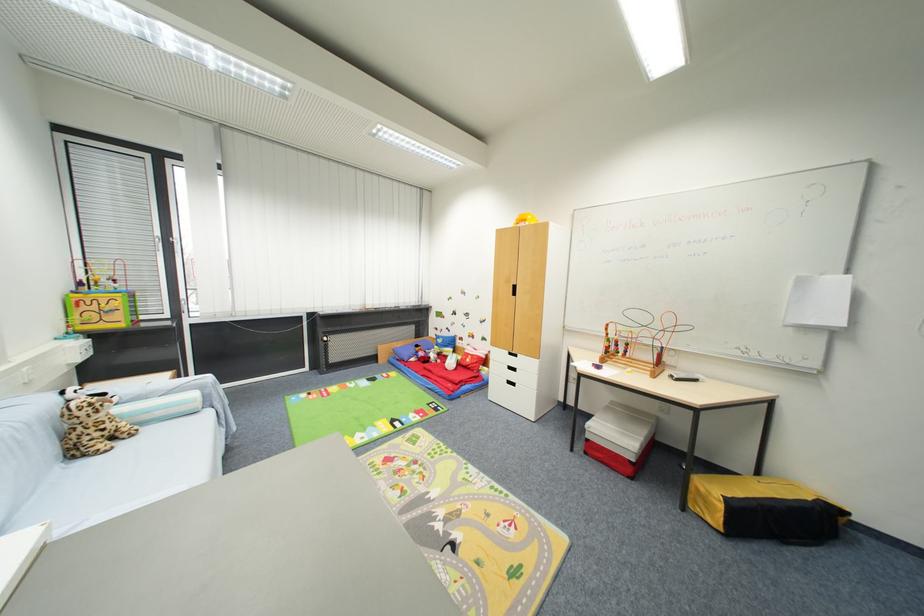
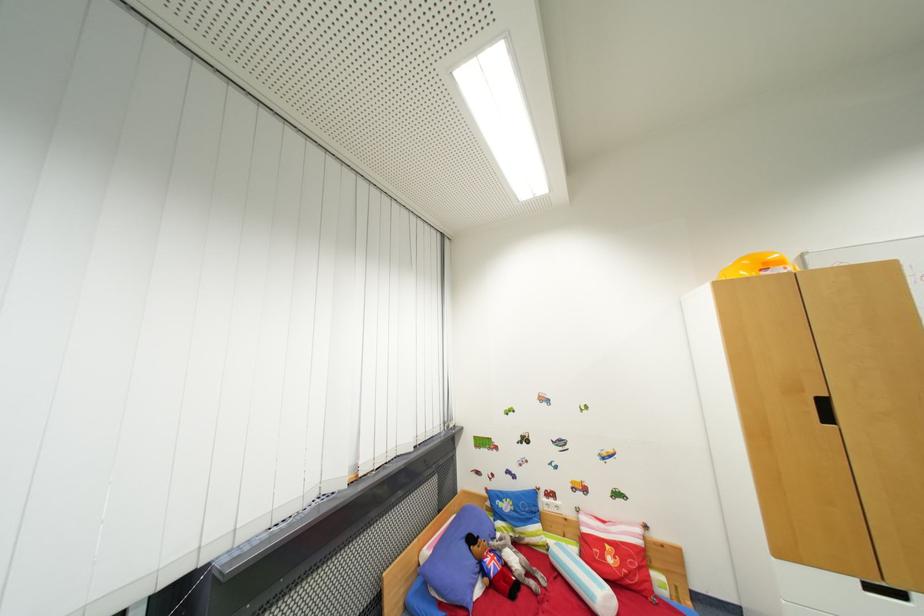
Where in the second image is the point corresponding to the point at 472,362 from the first image?

(614, 562)